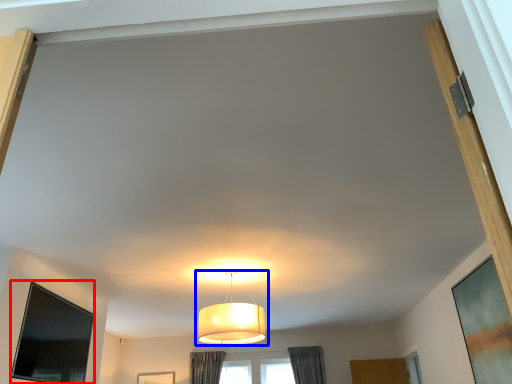
Question: Among these objects, which one is nearest to the camera, window screen (highlighted by a red box) or lamp (highlighted by a blue box)?

Choices:
 (A) window screen
 (B) lamp

Answer: (A)